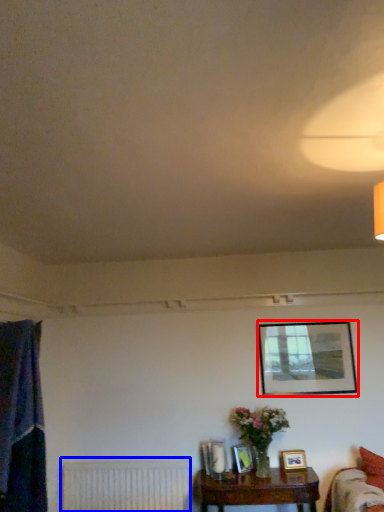
Question: Among these objects, which one is nearest to the camera, picture frame (highlighted by a red box) or radiator (highlighted by a blue box)?

Choices:
 (A) picture frame
 (B) radiator

Answer: (B)